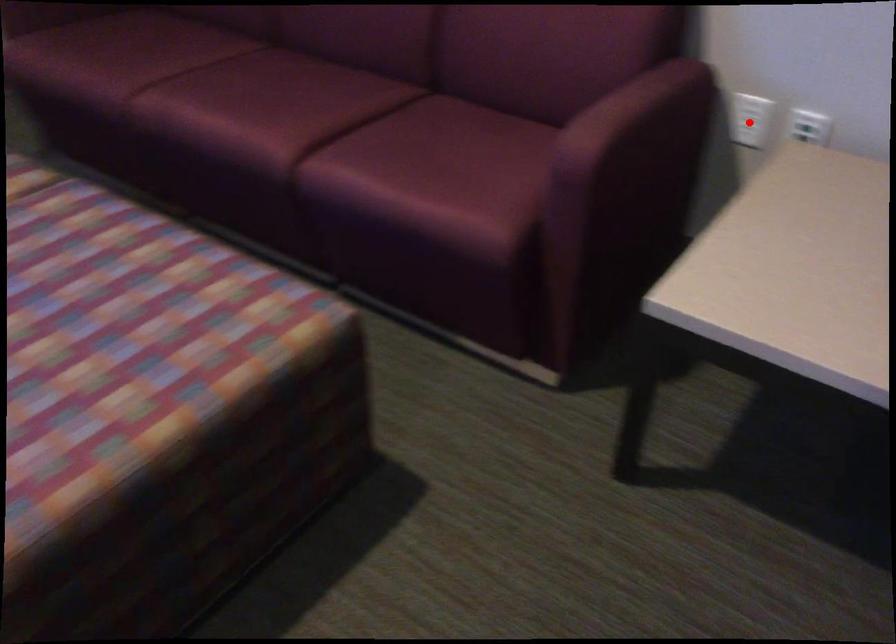
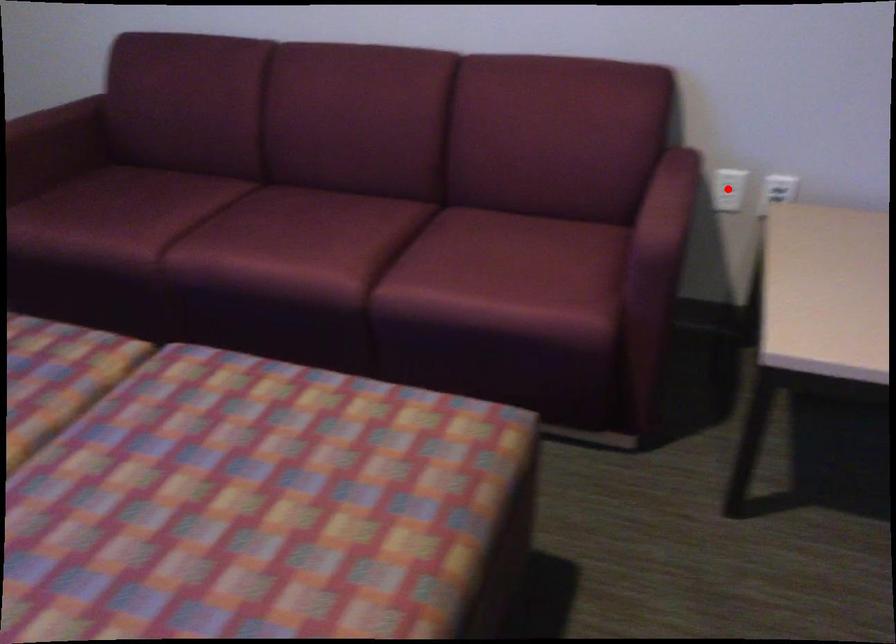
I am providing you with two images of the same scene from different viewpoints. A red point is marked on the first image and another point is marked on the second image. Do the highlighted points in image1 and image2 indicate the same real-world spot?

Yes